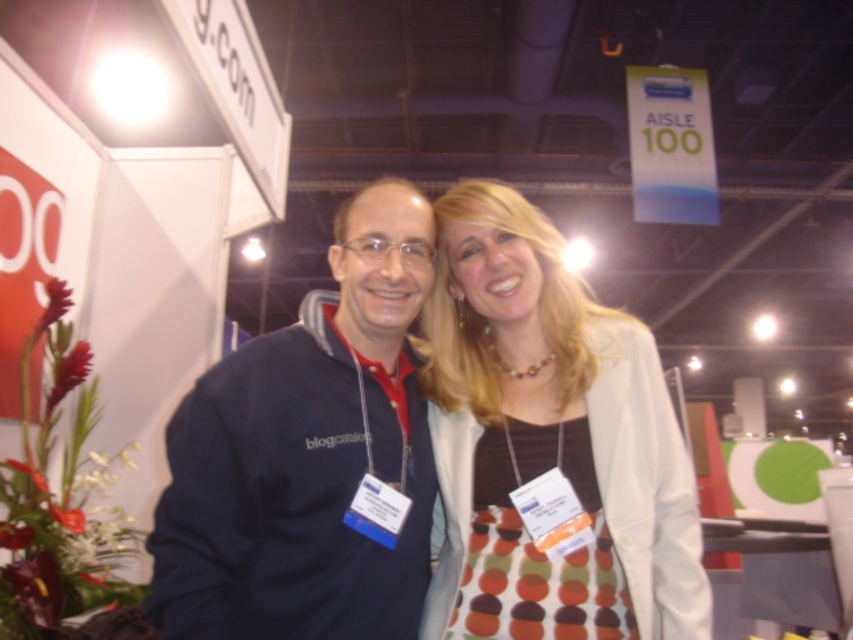
Is point (496, 356) less distant than point (314, 625)?

No, (496, 356) is further to viewer.

Locate an element on the screen. This screenshot has height=640, width=853. polka dot fabric dress at center is located at coordinates (548, 440).

Find the location of a particular element. polka dot fabric dress at center is located at coordinates (548, 440).